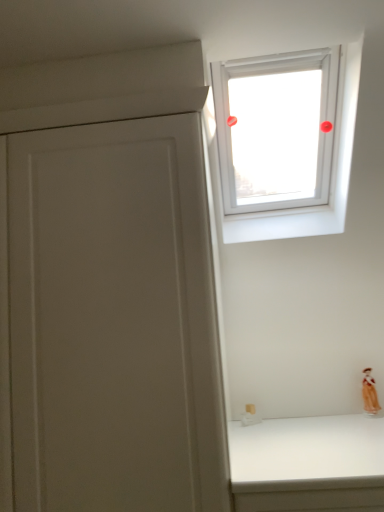
Question: Does transparent glass window at upper center turn towards matte orange figurine at lower right?

Choices:
 (A) yes
 (B) no

Answer: (B)

Question: From a real-world perspective, is transparent glass window at upper center on top of matte orange figurine at lower right?

Choices:
 (A) no
 (B) yes

Answer: (B)

Question: Is matte orange figurine at lower right inside transparent glass window at upper center?

Choices:
 (A) no
 (B) yes

Answer: (A)

Question: Is transparent glass window at upper center at the left side of matte orange figurine at lower right?

Choices:
 (A) yes
 (B) no

Answer: (A)

Question: Does transparent glass window at upper center have a greater width compared to matte orange figurine at lower right?

Choices:
 (A) no
 (B) yes

Answer: (B)

Question: Does transparent glass window at upper center have a lesser height compared to matte orange figurine at lower right?

Choices:
 (A) no
 (B) yes

Answer: (A)

Question: Is matte orange figurine at lower right at the right side of transparent glass window at upper center?

Choices:
 (A) no
 (B) yes

Answer: (B)

Question: Considering the relative positions of matte orange figurine at lower right and transparent glass window at upper center in the image provided, is matte orange figurine at lower right behind transparent glass window at upper center?

Choices:
 (A) no
 (B) yes

Answer: (B)

Question: Can you confirm if matte orange figurine at lower right is wider than transparent glass window at upper center?

Choices:
 (A) no
 (B) yes

Answer: (A)

Question: Is matte orange figurine at lower right thinner than transparent glass window at upper center?

Choices:
 (A) no
 (B) yes

Answer: (B)

Question: Would you say transparent glass window at upper center is part of matte orange figurine at lower right's contents?

Choices:
 (A) yes
 (B) no

Answer: (B)

Question: Does matte orange figurine at lower right have a greater height compared to transparent glass window at upper center?

Choices:
 (A) yes
 (B) no

Answer: (B)

Question: Considering the relative positions of transparent glass window at upper center and matte orange figurine at lower right in the image provided, is transparent glass window at upper center to the left or to the right of matte orange figurine at lower right?

Choices:
 (A) right
 (B) left

Answer: (B)